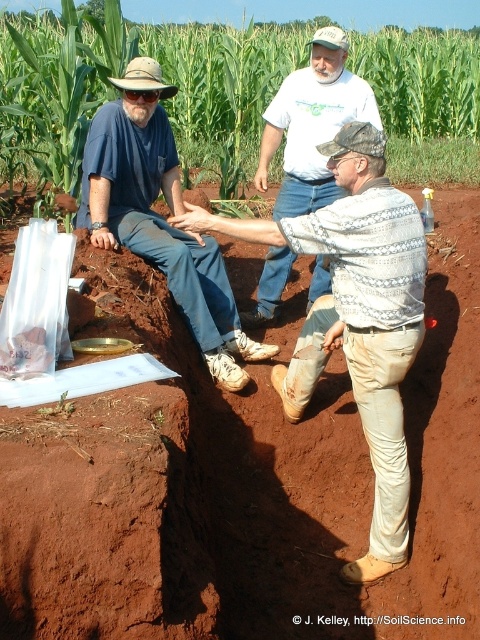
Question: From the image, what is the correct spatial relationship of reddish-brown soil at center in relation to white t-shirt at center?

Choices:
 (A) below
 (B) above

Answer: (A)

Question: Is reddish-brown soil at center above green leafy corn at upper left?

Choices:
 (A) no
 (B) yes

Answer: (A)

Question: Which point is closer to the camera taking this photo?

Choices:
 (A) (109, 125)
 (B) (291, 372)
 (C) (397, 76)
 (D) (308, 99)

Answer: (B)

Question: Can you confirm if green leafy corn at upper left is positioned to the right of worn beige pants at center?

Choices:
 (A) no
 (B) yes

Answer: (A)

Question: Among these objects, which one is farthest from the camera?

Choices:
 (A) reddish-brown soil at center
 (B) white t-shirt at center
 (C) worn beige pants at center
 (D) matte blue jeans at left

Answer: (B)

Question: Which object is farther from the camera taking this photo?

Choices:
 (A) green leafy corn at upper left
 (B) matte blue jeans at left
 (C) white t-shirt at center

Answer: (A)